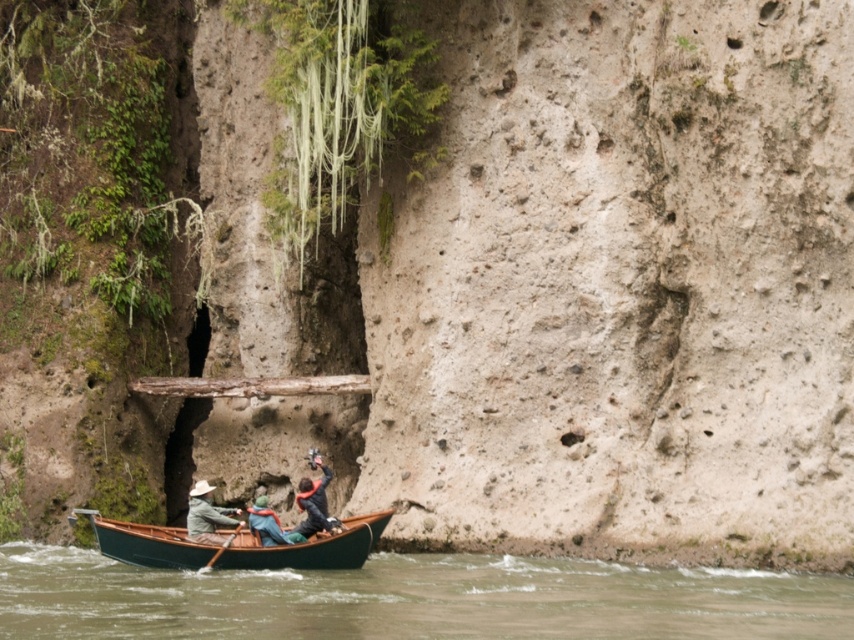
Does green polished wood canoe at lower center appear on the left side of wooden paddle at lower center?

No, green polished wood canoe at lower center is not to the left of wooden paddle at lower center.

Which is more to the left, green polished wood canoe at lower center or wooden paddle at lower center?

From the viewer's perspective, wooden paddle at lower center appears more on the left side.

Is point (133, 561) positioned in front of point (231, 532)?

That is True.

Where is `green polished wood canoe at lower center`? green polished wood canoe at lower center is located at coordinates (309, 547).

This screenshot has height=640, width=854. I want to click on light brown leather jacket at lower left, so click(206, 515).

Based on the photo, who is positioned more to the right, light brown leather jacket at lower left or blue fabric jacket at center?

Positioned to the right is blue fabric jacket at center.

This screenshot has height=640, width=854. Identify the location of light brown leather jacket at lower left. (206, 515).

Identify the location of light brown leather jacket at lower left. The image size is (854, 640). (206, 515).

Between green polished wood canoe at lower center and blue fabric jacket at center, which one is positioned higher?

blue fabric jacket at center is above.

Who is more forward, (349, 536) or (279, 532)?

Point (349, 536) is more forward.

Image resolution: width=854 pixels, height=640 pixels. What do you see at coordinates (309, 547) in the screenshot?
I see `green polished wood canoe at lower center` at bounding box center [309, 547].

You are a GUI agent. You are given a task and a screenshot of the screen. Output one action in this format:
    pyautogui.click(x=<x>, y=<y>)
    Task: Click on the green polished wood canoe at lower center
    The width and height of the screenshot is (854, 640).
    Given the screenshot: What is the action you would take?
    pyautogui.click(x=309, y=547)